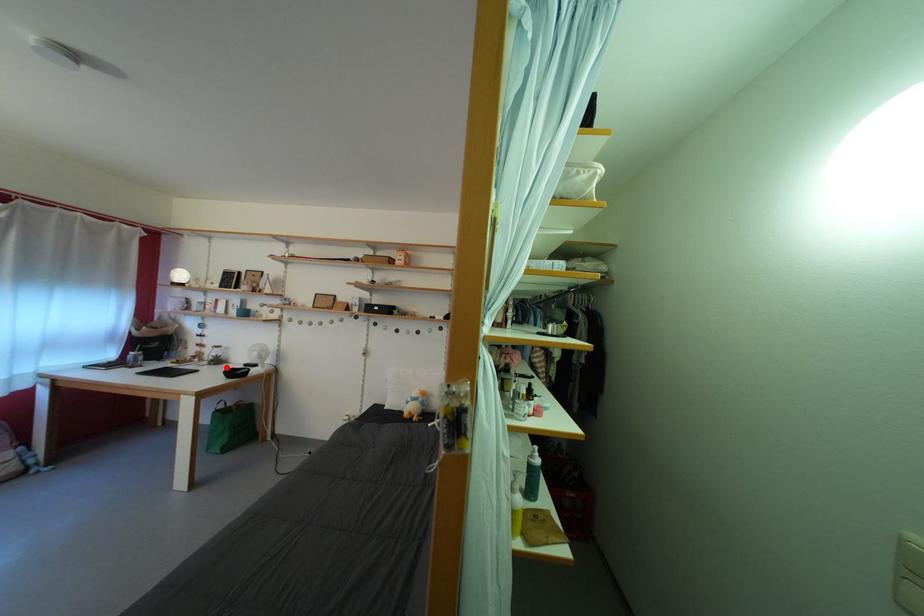
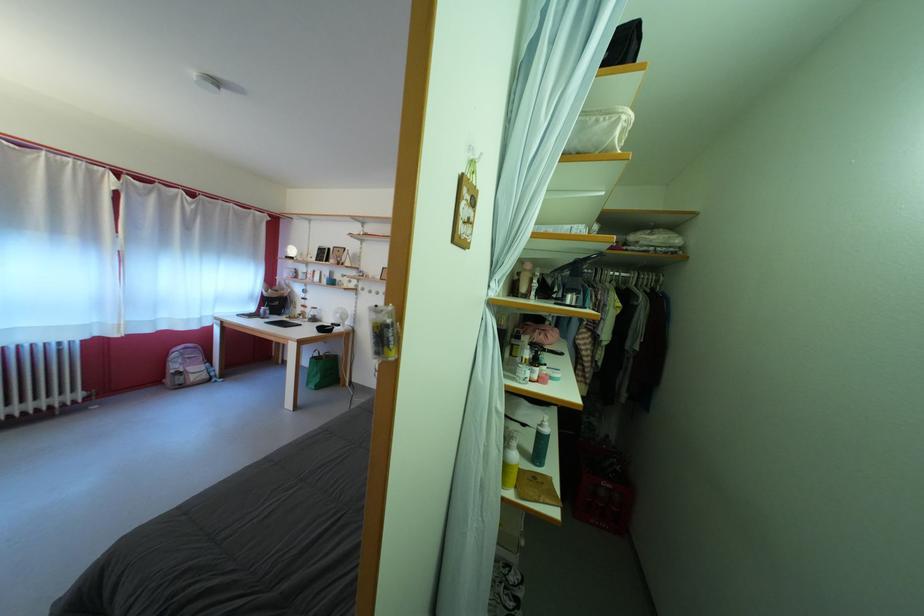
In the second image, find the point that corresponds to the highlighted location in the first image.

(322, 325)